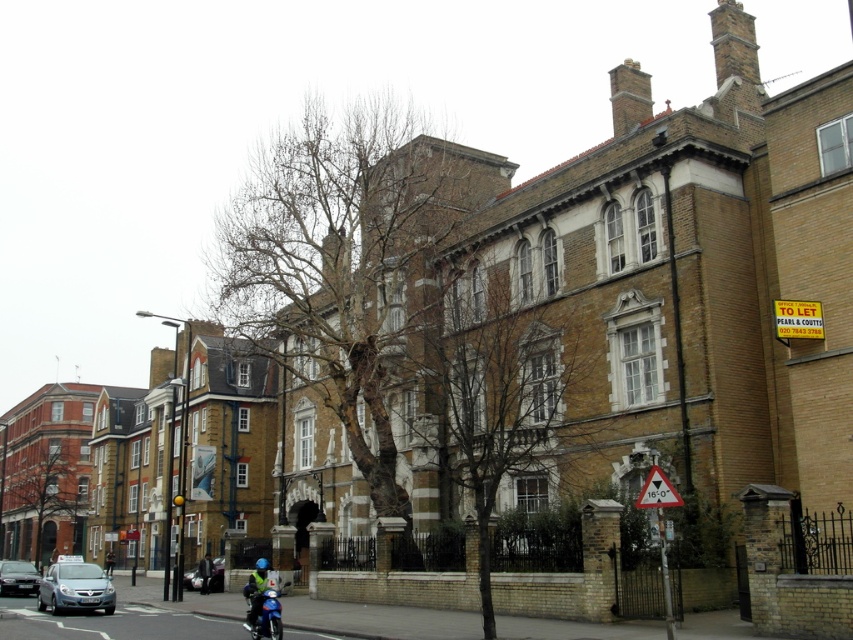
Question: Does silver metallic car at lower left come behind blue fabric helmet at lower center?

Choices:
 (A) yes
 (B) no

Answer: (A)

Question: Estimate the real-world distances between objects in this image. Which object is closer to the silver metallic car at lower left?

Choices:
 (A) metallic silver car at lower left
 (B) metal triangular sign at center
 (C) blue fabric helmet at lower center

Answer: (C)

Question: Can you confirm if blue fabric helmet at lower center is bigger than metallic silver car at lower left?

Choices:
 (A) yes
 (B) no

Answer: (A)

Question: Among these points, which one is farthest from the camera?

Choices:
 (A) (676, 497)
 (B) (44, 596)

Answer: (B)

Question: Can you confirm if matte silver car at lower left is smaller than metallic silver car at lower left?

Choices:
 (A) no
 (B) yes

Answer: (A)

Question: Among these objects, which one is nearest to the camera?

Choices:
 (A) blue fabric helmet at lower center
 (B) dark gray suit at center
 (C) metallic silver car at lower left
 (D) matte silver car at lower left

Answer: (A)